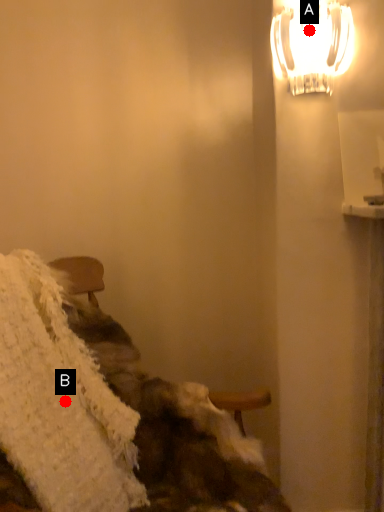
Question: Two points are circled on the image, labeled by A and B beside each circle. Which point is farther from the camera taking this photo?

Choices:
 (A) A is further
 (B) B is further

Answer: (A)